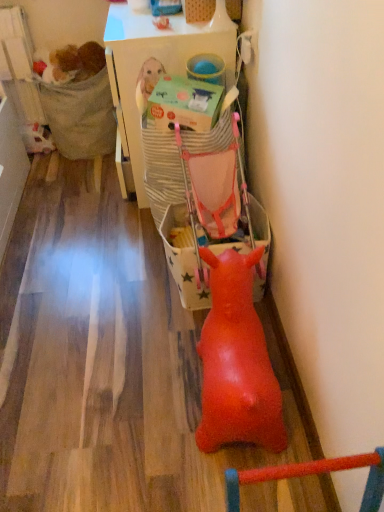
At what (x,y) coordinates should I click in order to perform the action: click on free space to the left of rubber duck at center. Please return your answer as a coordinate pair (x, y). The image size is (384, 512). Looking at the image, I should click on (111, 386).